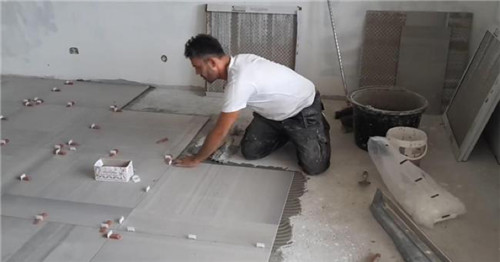
At what (x,y) coordinates should I click in order to perform the action: click on paint. Please return your answer as a coordinate pair (x, y). This screenshot has width=500, height=262. Looking at the image, I should click on (43, 18).